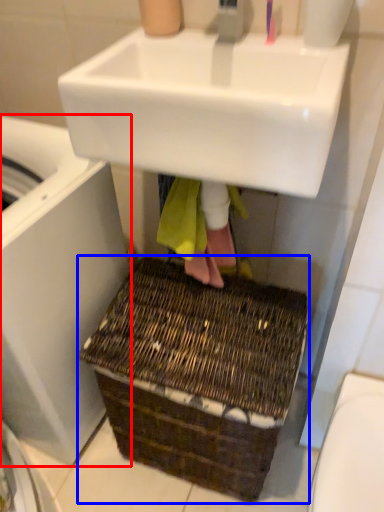
Question: Which object appears closest to the camera in this image, washing machine (highlighted by a red box) or basket (highlighted by a blue box)?

Choices:
 (A) washing machine
 (B) basket

Answer: (A)